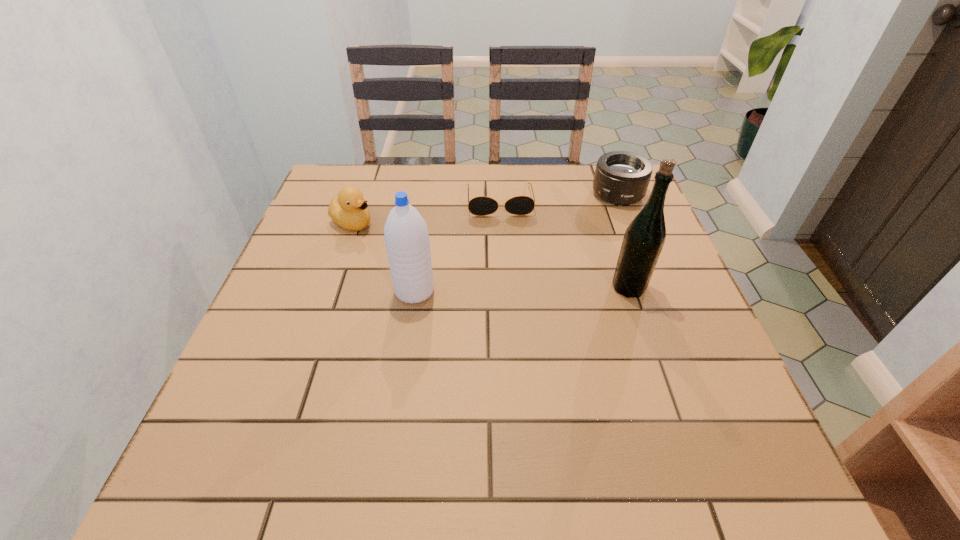
At what (x,y) coordinates should I click in order to perform the action: click on the second object from left to right. Please return your answer as a coordinate pair (x, y). This screenshot has height=540, width=960. Looking at the image, I should click on (406, 235).

Find the location of a particular element. water bottle is located at coordinates (406, 235).

I want to click on beer bottle, so (644, 238).

I want to click on sunglasses, so click(x=482, y=205).

The image size is (960, 540). In order to click on the shortest object in this screenshot , I will do `click(482, 205)`.

At what (x,y) coordinates should I click in order to perform the action: click on telephoto lens. Please return your answer as a coordinate pair (x, y). Looking at the image, I should click on (621, 178).

This screenshot has height=540, width=960. Identify the location of duckling. (349, 210).

What are the coordinates of `free space located on the left of the second tallest object` in the screenshot? It's located at (297, 292).

This screenshot has width=960, height=540. I want to click on free spot located on the left of the tallest object, so click(510, 287).

Where is `vacant area situated 0.190m on the front-facing side of the shortest object`? vacant area situated 0.190m on the front-facing side of the shortest object is located at coordinates (506, 265).